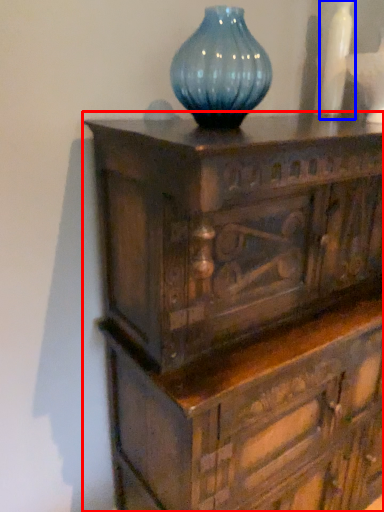
Question: Among these objects, which one is nearest to the camera, chest of drawers (highlighted by a red box) or vase (highlighted by a blue box)?

Choices:
 (A) chest of drawers
 (B) vase

Answer: (A)